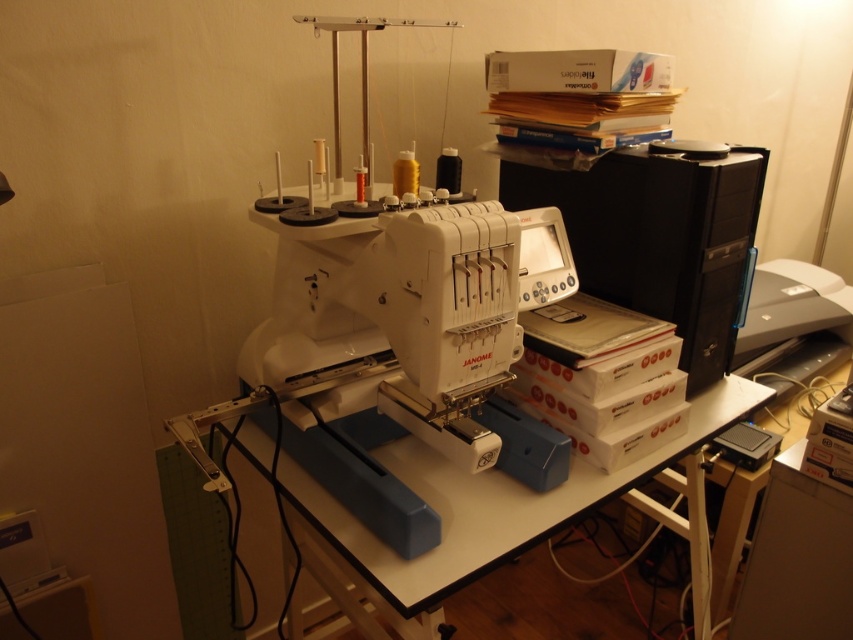
You are organizing the workspace and need to place a new sewing machine manual. The manual requires a flat surface larger than the black plastic computer at right. Can the white plastic table at center accommodate it?

The white plastic table at center can accommodate the sewing machine manual because it occupies more space than the black plastic computer at right.

You are organizing the workspace and need to place a new item at the point marked by the coordinates point (654, 236). What object is already located at this position?

The point (654, 236) indicates the location of the black plastic computer at right.

Looking at this image, you need to place a rectangular box that is 20 cm thick between the white plastic sewing machine at center and the white plastic table at center. Is there enough space for it?

The white plastic sewing machine at center is thinner than the white plastic table at center. Since the sewing machine is thinner, the space between them is sufficient to fit a 20 cm thick box.